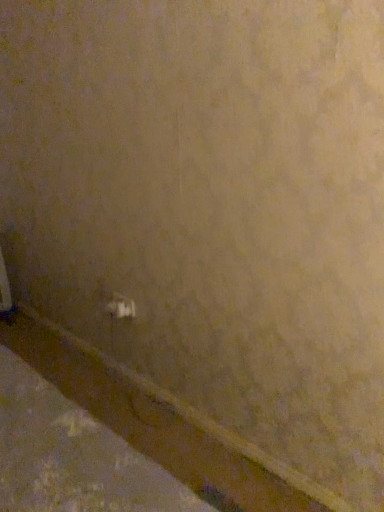
What are the coordinates of `vacant space situated above white matte molding at lower left (from a real-world perspective)` in the screenshot? It's located at tap(200, 416).